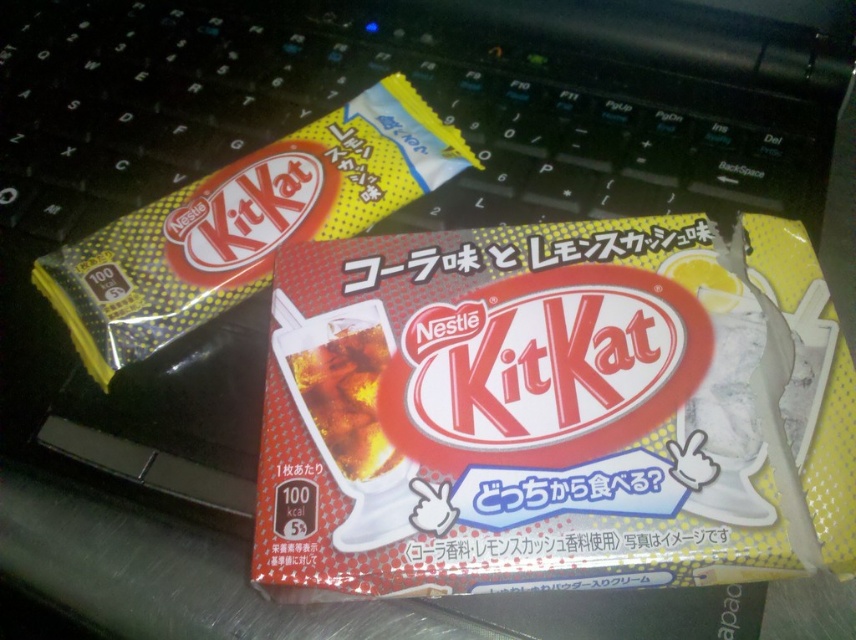
Question: Which point is farther to the camera?

Choices:
 (A) matte plastic kitkat at center
 (B) yellow matte kitkat bar at upper left
 (C) translucent plastic soda at center

Answer: (B)

Question: Can you confirm if matte plastic kitkat at center is positioned to the left of translucent plastic soda at center?

Choices:
 (A) yes
 (B) no

Answer: (B)

Question: Considering the real-world distances, which object is farthest from the matte plastic kitkat at center?

Choices:
 (A) translucent plastic soda at center
 (B) yellow matte kitkat bar at upper left

Answer: (B)

Question: Which of the following is the closest to the observer?

Choices:
 (A) (732, 371)
 (B) (223, 189)

Answer: (A)

Question: From the image, what is the correct spatial relationship of matte plastic kitkat at center in relation to yellow matte kitkat bar at upper left?

Choices:
 (A) right
 (B) left

Answer: (A)

Question: Is yellow matte kitkat bar at upper left wider than translucent plastic soda at center?

Choices:
 (A) no
 (B) yes

Answer: (B)